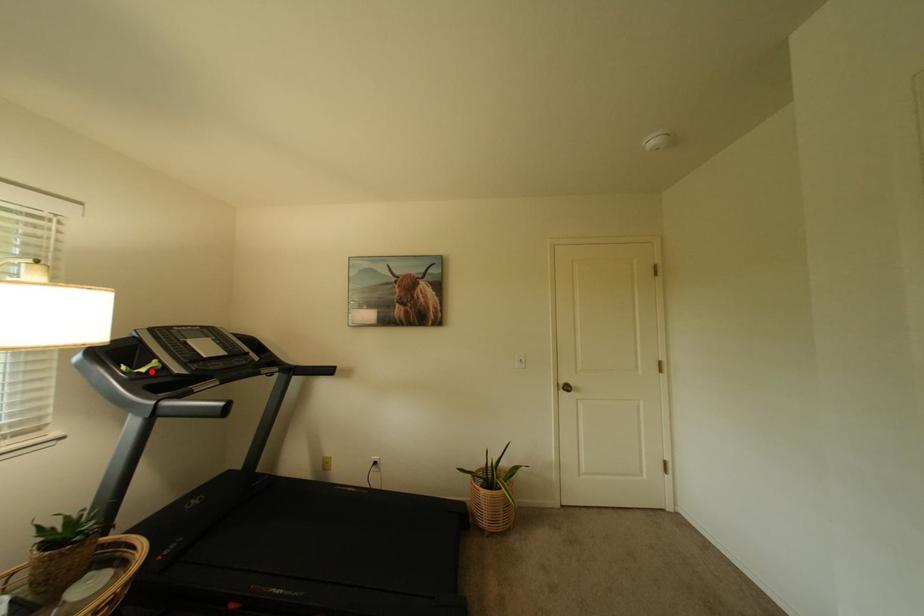
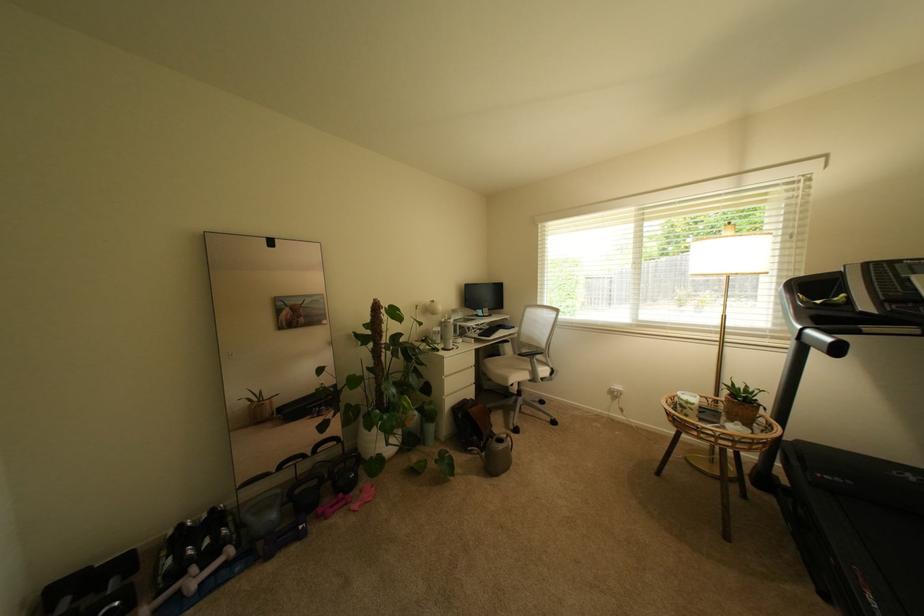
Where in the second image is the point corresponding to the highlighted location from the first image?

(827, 302)